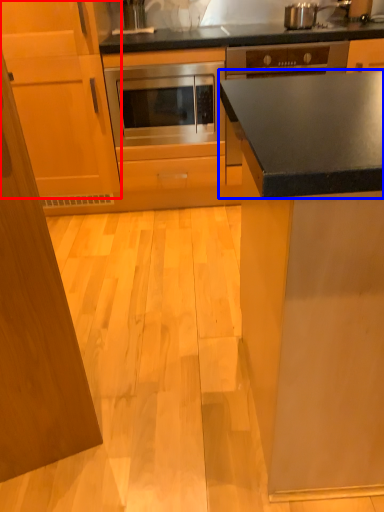
Question: Among these objects, which one is farthest to the camera, cabinetry (highlighted by a red box) or countertop (highlighted by a blue box)?

Choices:
 (A) cabinetry
 (B) countertop

Answer: (B)